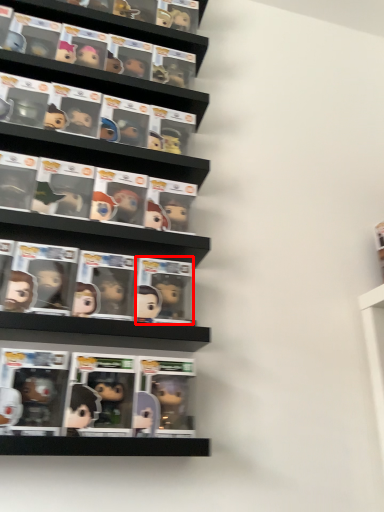
Question: From the image's perspective, what is the correct spatial positioning of comic book (annotated by the red box) in reference to comic book?

Choices:
 (A) below
 (B) above

Answer: (A)